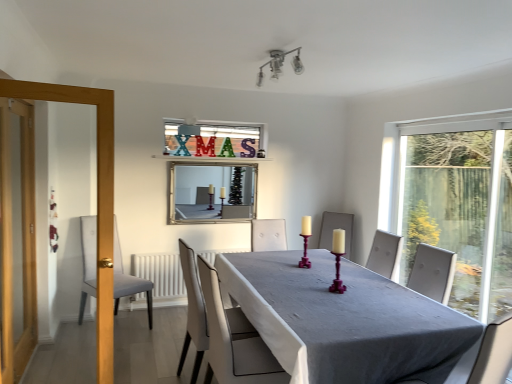
The image size is (512, 384). Find the location of `free point above white matte radiator at lower center (from a real-world perspective)`. free point above white matte radiator at lower center (from a real-world perspective) is located at coordinates [x=200, y=249].